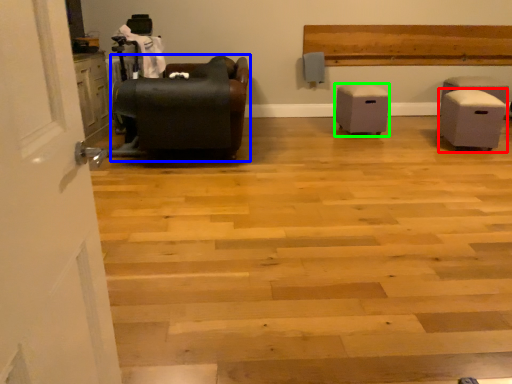
Question: Which object is the closest to the furniture (highlighted by a red box)? Choose among these: furniture (highlighted by a blue box) or furniture (highlighted by a green box).

Choices:
 (A) furniture
 (B) furniture

Answer: (B)